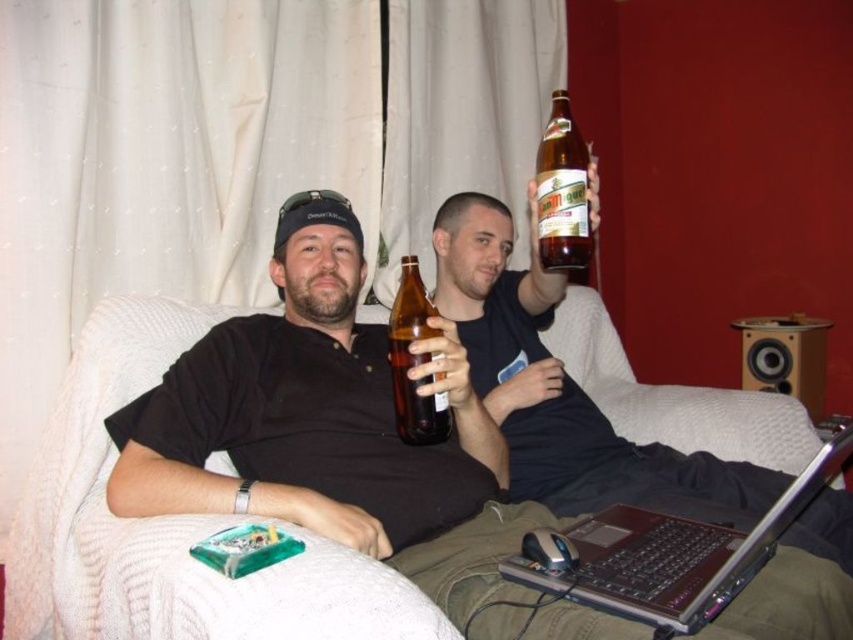
Question: Does matte black shirt at center have a smaller size compared to brown glass bottle at upper center?

Choices:
 (A) yes
 (B) no

Answer: (B)

Question: Observing the image, what is the correct spatial positioning of matte black shirt at center in reference to brown glass bottle at upper center?

Choices:
 (A) left
 (B) right

Answer: (A)

Question: Considering the real-world distances, which object is farthest from the brown plastic laptop at lower center?

Choices:
 (A) brown glass bottle at upper center
 (B) brown glass bottle at center

Answer: (A)

Question: Does brown glass bottle at upper center appear over brown glass bottle at center?

Choices:
 (A) yes
 (B) no

Answer: (A)

Question: Which of the following is the farthest from the observer?

Choices:
 (A) (415, 429)
 (B) (561, 176)
 (C) (132, 500)
 (D) (666, 564)

Answer: (A)

Question: Which of the following is the closest to the observer?

Choices:
 (A) (782, 508)
 (B) (569, 129)
 (C) (459, 620)
 (D) (410, 324)

Answer: (A)